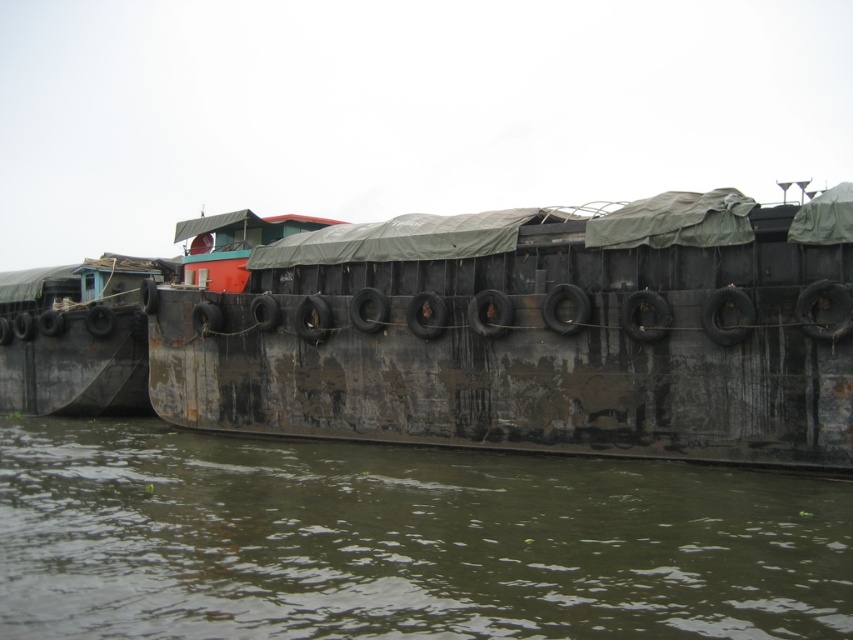
Question: Which point is closer to the camera taking this photo?

Choices:
 (A) (126, 369)
 (B) (357, 545)
 (C) (840, 454)

Answer: (B)

Question: Which of the following is the farthest from the observer?

Choices:
 (A) rusty metal barge at center
 (B) rusty metal barge at left
 (C) brown murky water at lower center

Answer: (B)

Question: Based on their relative distances, which object is nearer to the brown murky water at lower center?

Choices:
 (A) rusty metal barge at center
 (B) rusty metal barge at left

Answer: (A)

Question: Can you confirm if brown murky water at lower center is positioned below rusty metal barge at left?

Choices:
 (A) yes
 (B) no

Answer: (A)

Question: From the image, what is the correct spatial relationship of brown murky water at lower center in relation to rusty metal barge at center?

Choices:
 (A) right
 (B) left

Answer: (B)

Question: Does brown murky water at lower center appear over rusty metal barge at center?

Choices:
 (A) no
 (B) yes

Answer: (A)